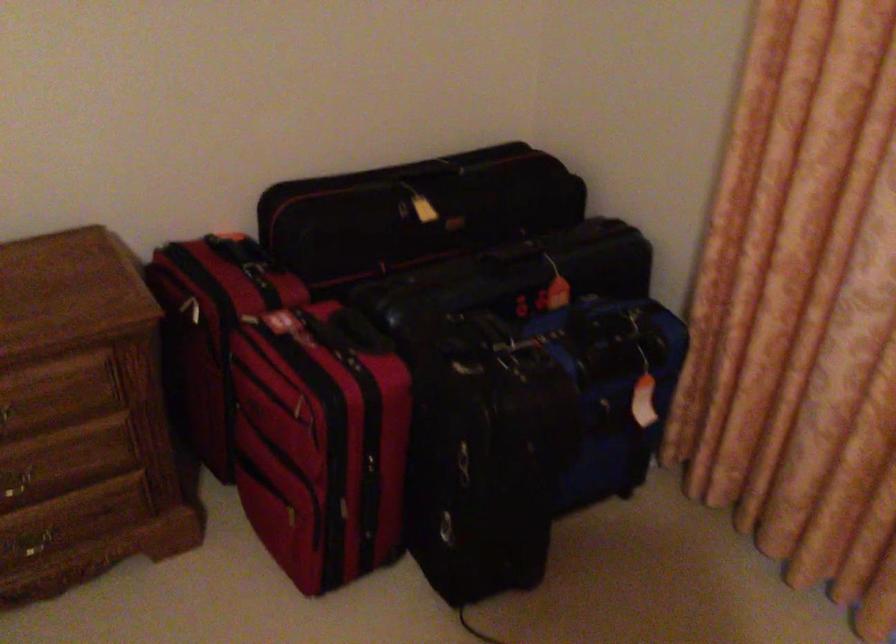
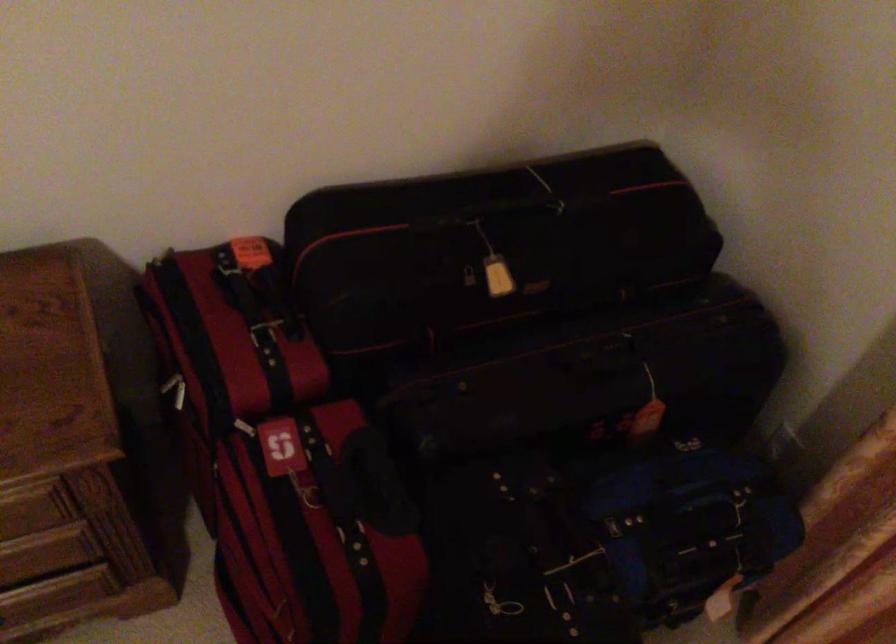
Where in the second image is the point corresponding to [405,221] from the first image?

(470, 287)